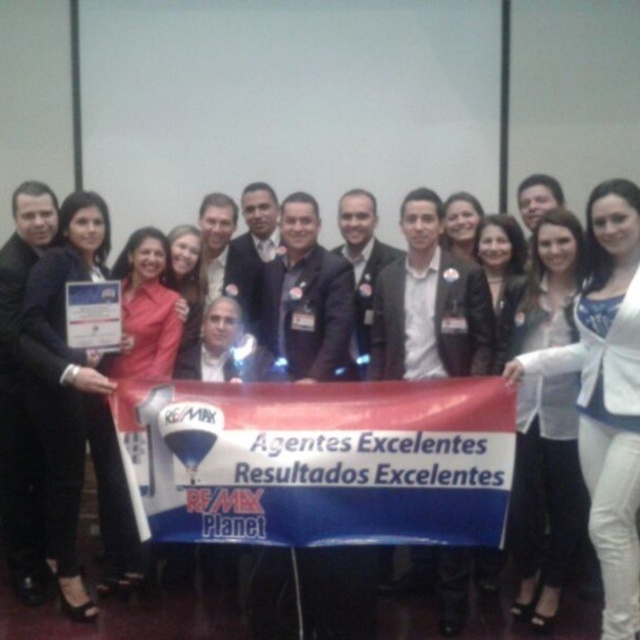
You are a photographer at the event and want to ensure the white glossy shirt at center is visible in the photo. Is the blue fabric banner at center blocking it?

The blue fabric banner at center is in front of the white glossy shirt at center, so it is blocking the shirt and making it less visible.

You are a photographer taking a photo of the group. You notice the blue fabric banner at center and the white glossy shirt at center. Which object is positioned higher in the image?

The blue fabric banner at center is positioned higher than the white glossy shirt at center.

You are standing in the photo and want to find the white glossy blazer at center. What are the coordinates of its position?

The white glossy blazer at center is located at coordinates point (605,394).